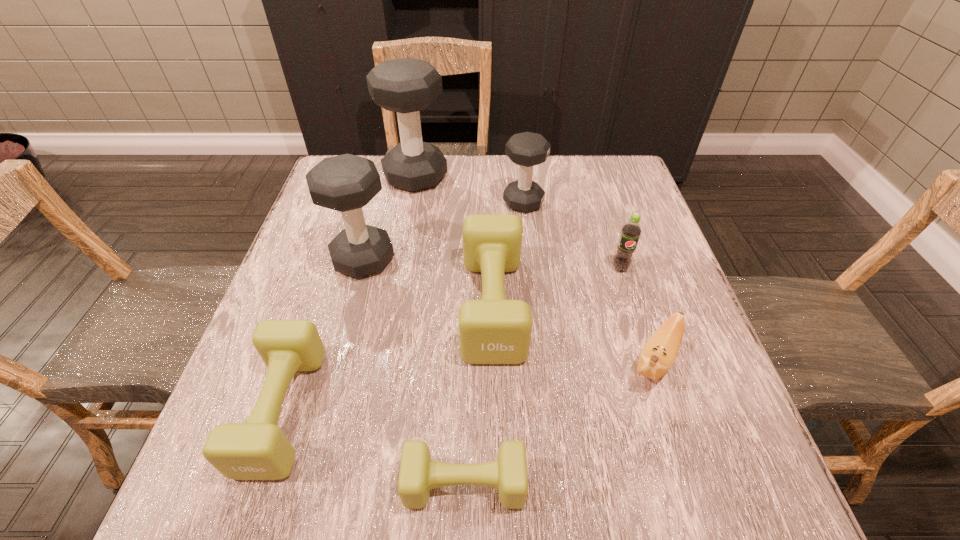
I want to click on vacant space at the far right corner, so click(619, 198).

Identify the location of free region at the near right corner. (675, 472).

This screenshot has height=540, width=960. What are the coordinates of `vacant space that's between the tallest dumbbell and the second shortest dumbbell` in the screenshot? It's located at (349, 293).

Locate an element on the screen. This screenshot has width=960, height=540. vacant area between the biggest gray dumbbell and the fourth tallest dumbbell is located at coordinates (454, 241).

This screenshot has width=960, height=540. Identify the location of free spot between the soda and the third tallest dumbbell. (572, 235).

Identify the location of vacant region between the shortest object and the yellow banana. (560, 422).

I want to click on vacant area between the third tallest dumbbell and the fifth shortest object, so click(572, 235).

This screenshot has width=960, height=540. In order to click on free space between the tallest dumbbell and the second biggest olive dumbbell in this screenshot , I will do `click(349, 293)`.

Locate an element on the screen. This screenshot has height=540, width=960. empty space that is in between the third tallest object and the banana is located at coordinates (589, 281).

Identify which object is located as the third nearest to the nearest gray dumbbell. Please provide its 2D coordinates. Your answer should be formatted as a tuple, i.e. [(x, y)], where the tuple contains the x and y coordinates of a point satisfying the conditions above.

[(258, 449)]